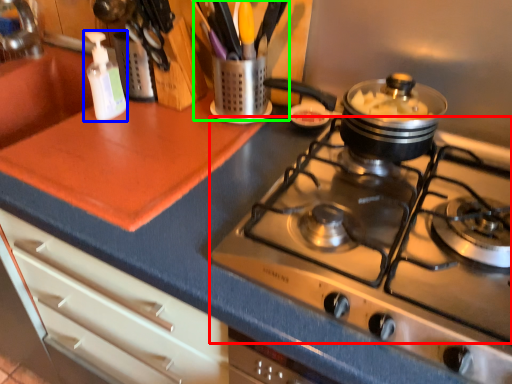
Question: Which is nearer to the gas stove (highlighted by a red box)? bottle (highlighted by a blue box) or appliance (highlighted by a green box).

Choices:
 (A) bottle
 (B) appliance

Answer: (B)